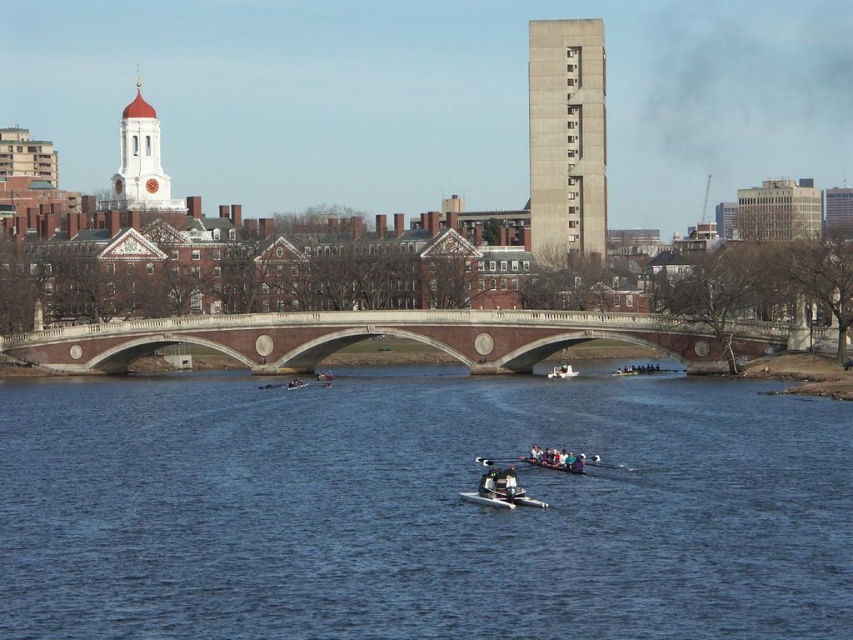
Between white plastic kayak at center and white plastic paddle at center, which one has less height?

white plastic paddle at center is shorter.

This screenshot has width=853, height=640. What do you see at coordinates (500, 490) in the screenshot?
I see `white plastic kayak at center` at bounding box center [500, 490].

Where is `white plastic kayak at center`? The height and width of the screenshot is (640, 853). white plastic kayak at center is located at coordinates (500, 490).

Can you confirm if matte brick clock tower at upper left is wider than white plastic kayak at center?

Yes, matte brick clock tower at upper left is wider than white plastic kayak at center.

Is matte brick clock tower at upper left in front of white plastic kayak at center?

No, it is behind white plastic kayak at center.

Is point (143, 195) farther from viewer compared to point (534, 504)?

Yes, it is behind point (534, 504).

Find the location of a particular element. matte brick clock tower at upper left is located at coordinates (141, 161).

Is brick stone bridge at center smaller than concrete block building at upper center?

Correct, brick stone bridge at center occupies less space than concrete block building at upper center.

Who is taller, brick stone bridge at center or concrete block building at upper center?

concrete block building at upper center

Does point (286, 332) lie in front of point (587, 204)?

Yes, it is in front of point (587, 204).

Where is `brick stone bridge at center`? brick stone bridge at center is located at coordinates (363, 339).